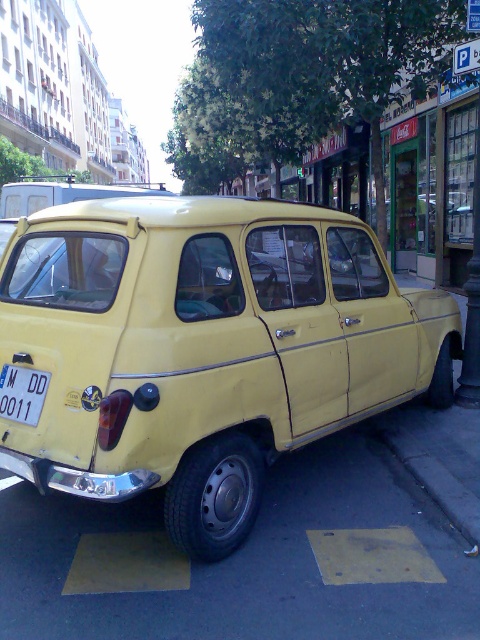
Measure the distance from yellow matte car at center to white plastic license plate at center.

The distance of yellow matte car at center from white plastic license plate at center is 3.69 feet.

Identify the location of yellow matte car at center. (204, 348).